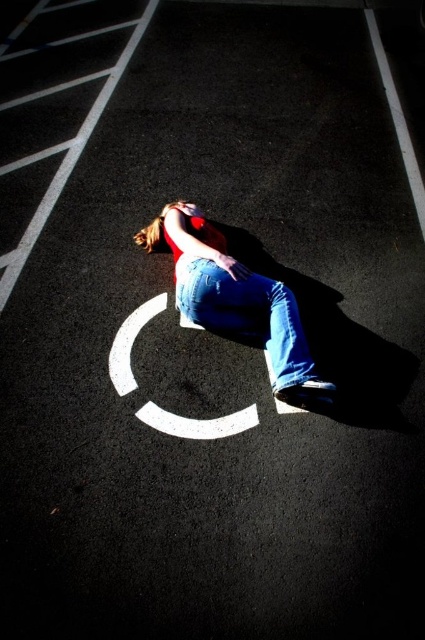
Question: Can you confirm if denim jeans at center is thinner than jeans at center?

Choices:
 (A) no
 (B) yes

Answer: (A)

Question: Which object is closer to the camera taking this photo?

Choices:
 (A) jeans at center
 (B) white painted circle at center
 (C) denim jeans at center

Answer: (C)

Question: Which point is closer to the camera taking this photo?

Choices:
 (A) (124, 332)
 (B) (314, 369)
 (C) (195, 269)

Answer: (B)

Question: Observing the image, what is the correct spatial positioning of jeans at center in reference to white painted circle at center?

Choices:
 (A) above
 (B) below

Answer: (A)

Question: Can you confirm if denim jeans at center is wider than jeans at center?

Choices:
 (A) no
 (B) yes

Answer: (B)

Question: Based on their relative distances, which object is farther from the denim jeans at center?

Choices:
 (A) jeans at center
 (B) white painted circle at center

Answer: (B)